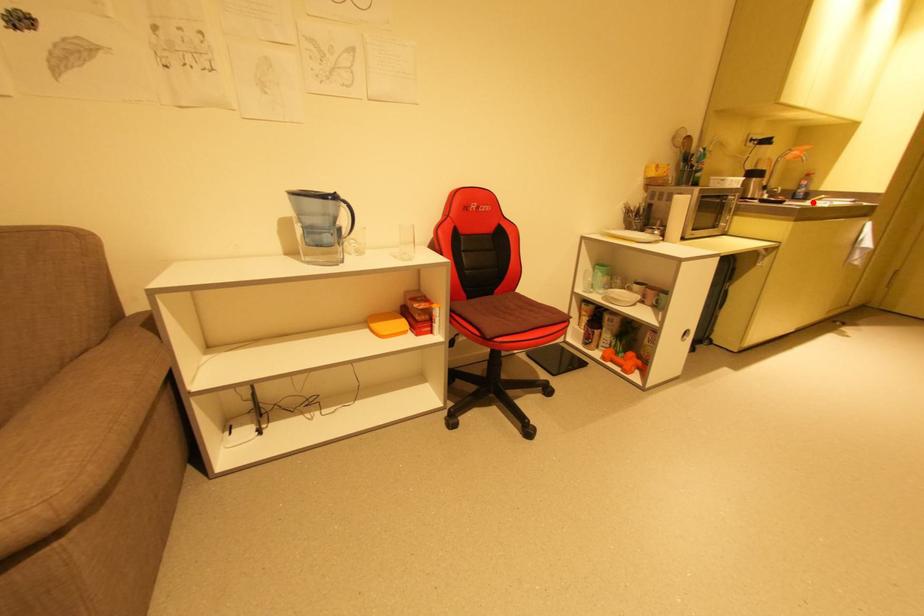
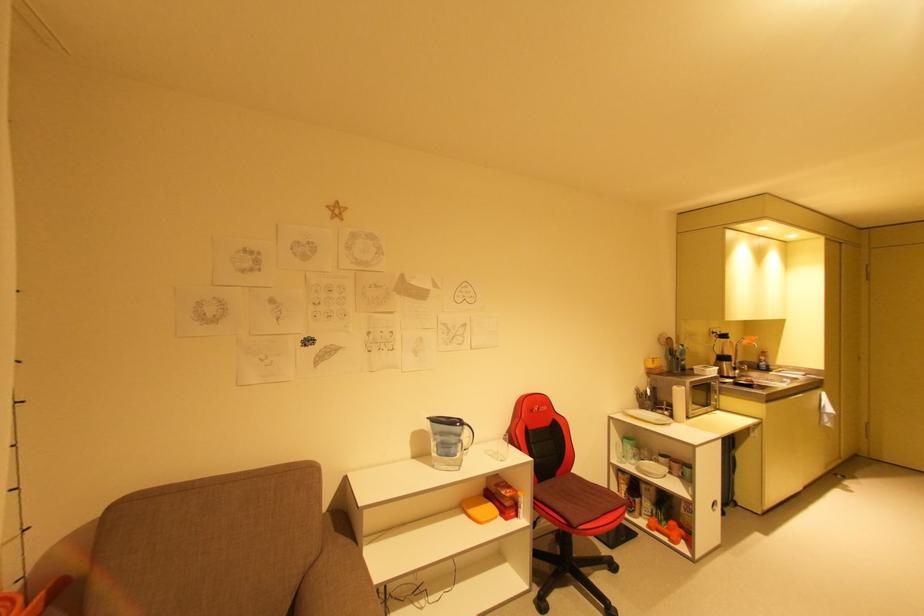
Question: I am providing you with two images of the same scene from different viewpoints. A red point is marked on the first image. Is the red point's position out of view in image 2?

Choices:
 (A) Yes
 (B) No

Answer: (B)